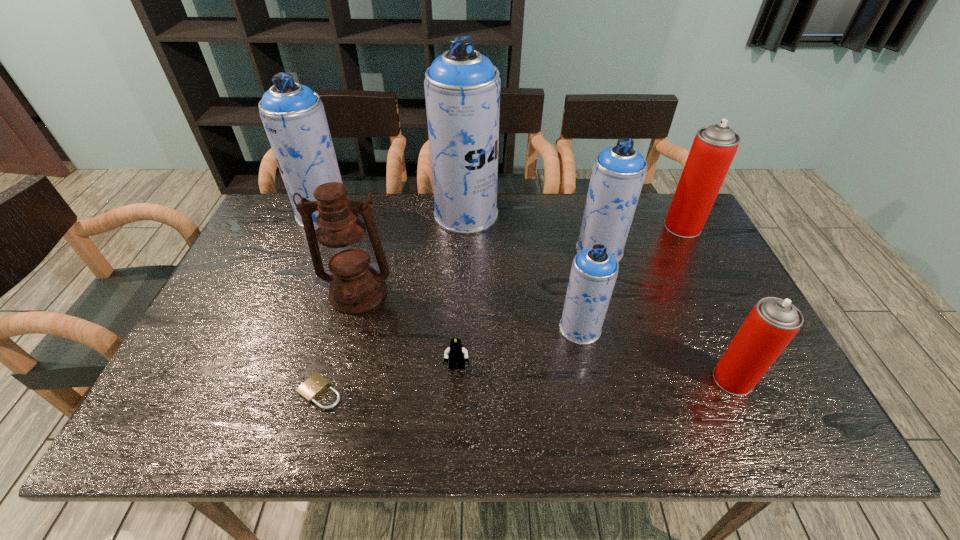
Identify the location of blue aerosol can that stands as the second closest to the nearest aerosol can. The width and height of the screenshot is (960, 540). tap(618, 173).

Locate an element on the screen. vacant space that satisfies the following two spatial constraints: 1. on the front side of the smallest blue aerosol can; 2. on the right side of the tallest aerosol can is located at coordinates (462, 328).

In order to click on vacant space that satisfies the following two spatial constraints: 1. on the front side of the second nearest blue aerosol can; 2. on the left side of the fifth aerosol can from right to left in this screenshot , I will do click(465, 251).